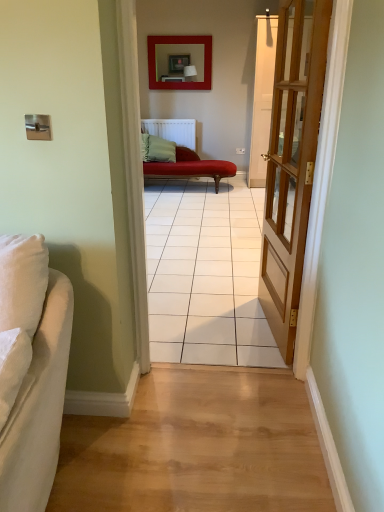
Question: Is matte red picture frame at upper center inside the boundaries of white fabric couch at left, the 2th studio couch in the back-to-front sequence, or outside?

Choices:
 (A) inside
 (B) outside

Answer: (B)

Question: From the image's perspective, is matte red picture frame at upper center above or below white fabric couch at left, the 2th studio couch when ordered from top to bottom?

Choices:
 (A) above
 (B) below

Answer: (A)

Question: Estimate the real-world distances between objects in this image. Which object is farther from the light wood floor at center?

Choices:
 (A) light brown wooden door at right
 (B) matte red picture frame at upper center
 (C) velvet red chaise at center, the 2th studio couch in the front-to-back sequence
 (D) white fabric couch at left, the 1th studio couch in the bottom-to-top sequence

Answer: (B)

Question: Based on their relative distances, which object is farther from the light wood floor at center?

Choices:
 (A) velvet red chaise at center, which is the 1th studio couch from top to bottom
 (B) matte red picture frame at upper center
 (C) white fabric couch at left, the 1th studio couch in the bottom-to-top sequence
 (D) light brown wooden door at right

Answer: (B)